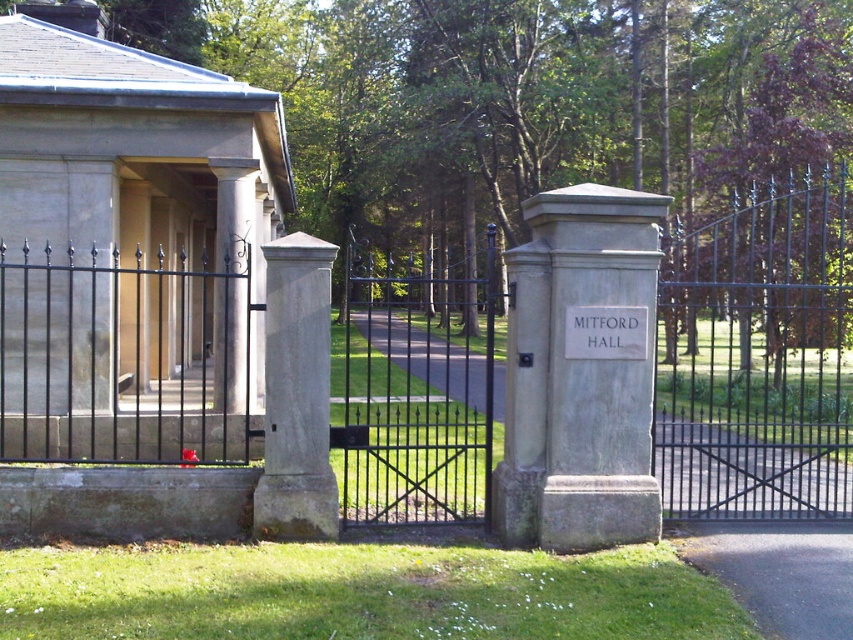
You are a delivery person approaching Mitford Hall and need to see the plaque on the gray stone sign at center. Since the black wrought iron gate at center is closed, can you still read the plaque without opening the gate?

The black wrought iron gate at center is much taller than the gray stone sign at center, so the sign is shorter and likely visible below the gate. You can read the plaque on the gray stone sign at center without opening the gate.

You are standing at the entrance of Mitford Hall and want to take a photo of the black metal fence at center. If your camera has a maximum focus range of 6 meters, will you be able to capture the fence clearly?

The black metal fence at center is 6.87 meters away from the camera. Since the camera can only focus up to 6 meters, it won not be able to capture the fence clearly.